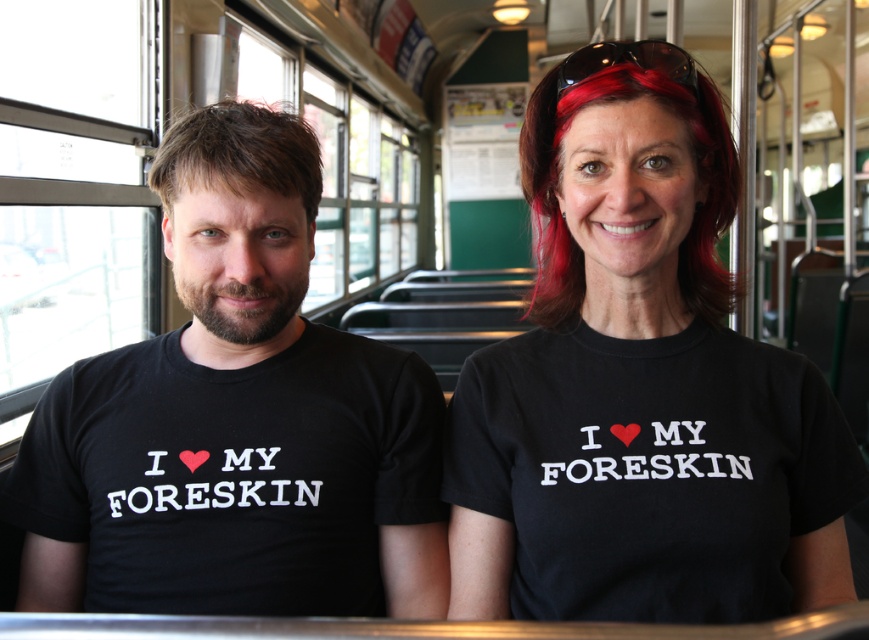
Does point (538, 300) come in front of point (240, 122)?

No, (538, 300) is further to viewer.

Between red dyed hair at upper center and brownhair at center, which one appears on the right side from the viewer's perspective?

Positioned to the right is red dyed hair at upper center.

Where is `red dyed hair at upper center`? Image resolution: width=869 pixels, height=640 pixels. red dyed hair at upper center is located at coordinates (556, 177).

Does black matte t-shirt at center have a larger size compared to red dyed hair at upper center?

Correct, black matte t-shirt at center is larger in size than red dyed hair at upper center.

Is the position of black matte t-shirt at center less distant than that of red dyed hair at upper center?

Yes, black matte t-shirt at center is closer to the viewer.

What are the coordinates of `black matte t-shirt at center` in the screenshot? It's located at (639, 387).

Can you confirm if black matte t-shirt at center is shorter than brownhair at center?

No.

Between black matte t-shirt at center and brownhair at center, which one has more height?

black matte t-shirt at center

Which is behind, point (505, 396) or point (234, 163)?

The point (505, 396) is more distant.

Where is `black matte t-shirt at center`? black matte t-shirt at center is located at coordinates (639, 387).